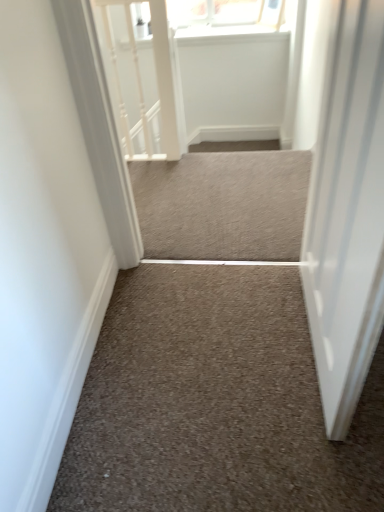
Question: Does white textured rail at upper left come behind white glossy door at right?

Choices:
 (A) no
 (B) yes

Answer: (B)

Question: Is the depth of white textured rail at upper left less than that of white glossy door at right?

Choices:
 (A) yes
 (B) no

Answer: (B)

Question: Is white textured rail at upper left oriented towards white glossy door at right?

Choices:
 (A) no
 (B) yes

Answer: (A)

Question: Is white textured rail at upper left to the left of white glossy door at right from the viewer's perspective?

Choices:
 (A) no
 (B) yes

Answer: (B)

Question: From a real-world perspective, is white textured rail at upper left on white glossy door at right?

Choices:
 (A) no
 (B) yes

Answer: (A)

Question: Is white textured rail at upper left positioned beyond the bounds of white glossy door at right?

Choices:
 (A) yes
 (B) no

Answer: (A)

Question: Considering the relative positions of neutral carpet at center, arranged as the second stairwell when viewed from the front, and white textured rail at upper left in the image provided, is neutral carpet at center, arranged as the second stairwell when viewed from the front, behind white textured rail at upper left?

Choices:
 (A) no
 (B) yes

Answer: (A)

Question: Is neutral carpet at center, which ranks as the 2th stairwell in bottom-to-top order, oriented away from white textured rail at upper left?

Choices:
 (A) no
 (B) yes

Answer: (A)

Question: Is neutral carpet at center, the first stairwell when ordered from top to bottom, bigger than white textured rail at upper left?

Choices:
 (A) yes
 (B) no

Answer: (B)

Question: Could white textured rail at upper left be considered to be inside neutral carpet at center, arranged as the second stairwell when viewed from the front?

Choices:
 (A) yes
 (B) no

Answer: (B)

Question: Considering the relative positions of neutral carpet at center, the first stairwell when ordered from top to bottom, and white textured rail at upper left in the image provided, is neutral carpet at center, the first stairwell when ordered from top to bottom, to the right of white textured rail at upper left from the viewer's perspective?

Choices:
 (A) yes
 (B) no

Answer: (A)

Question: Does neutral carpet at center, which ranks as the 2th stairwell in bottom-to-top order, have a smaller size compared to white textured rail at upper left?

Choices:
 (A) yes
 (B) no

Answer: (A)

Question: Does neutral carpet at center, which ranks as the 2th stairwell in bottom-to-top order, come behind neutral carpet at center, which appears as the 2th stairwell when viewed from the back?

Choices:
 (A) no
 (B) yes

Answer: (B)